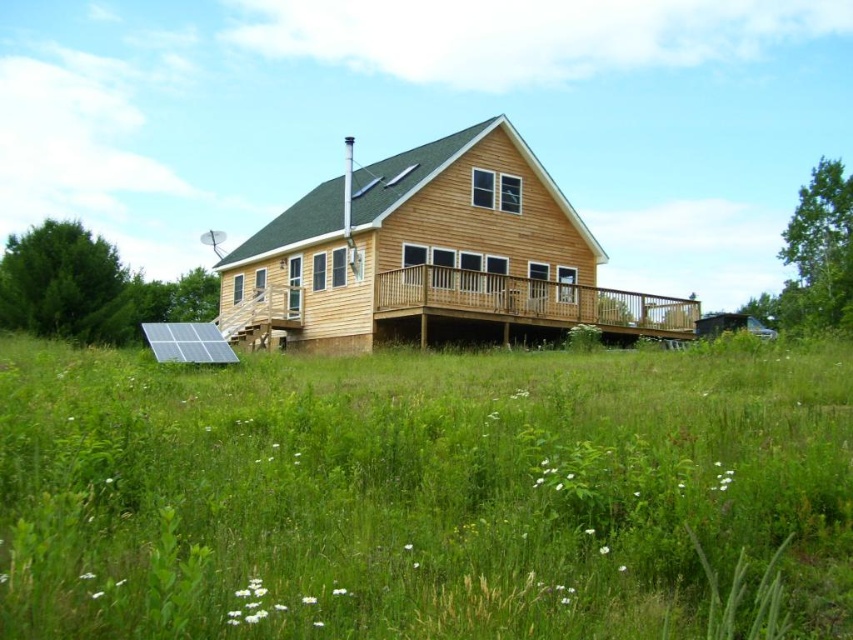
Question: From the image, what is the correct spatial relationship of green grass at center in relation to wooden deck at center?

Choices:
 (A) below
 (B) above

Answer: (A)

Question: Which point is farther to the camera?

Choices:
 (A) wooden deck at center
 (B) green grass at center

Answer: (A)

Question: Which of the following is the closest to the observer?

Choices:
 (A) wooden deck at center
 (B) green grass at center

Answer: (B)

Question: Can you confirm if green grass at center is positioned to the right of wooden deck at center?

Choices:
 (A) yes
 (B) no

Answer: (B)

Question: Which object is farther from the camera taking this photo?

Choices:
 (A) green grass at center
 (B) wooden deck at center

Answer: (B)

Question: Is green grass at center positioned in front of wooden deck at center?

Choices:
 (A) no
 (B) yes

Answer: (B)